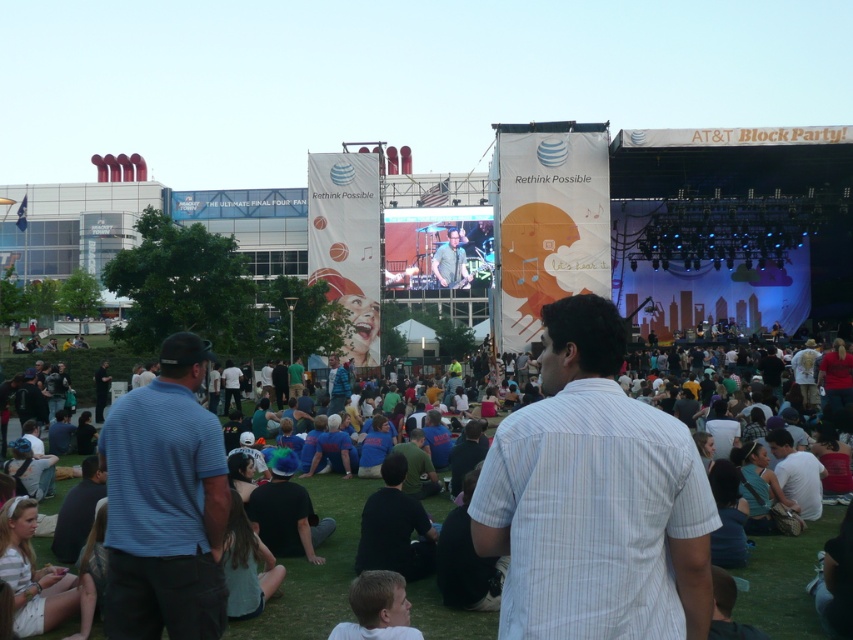
You are standing at the back of the crowd and want to see the stage better. There are two people in front of you, one wearing a dark gray shirt at center and the other wearing blue denim jeans at center. Which person should you ask to move so you can see better?

The dark gray shirt at center is much taller than the blue denim jeans at center, so you should ask the dark gray shirt at center to move to get a better view.

You are standing at the back of the crowd and want to see the stage. There are two people blocking your view in the center. The dark gray shirt at center and the blue denim jeans at center. Which one should you move around to the right to get a better view?

You should move around the blue denim jeans at center to the right since the dark gray shirt at center is already to the right of the blue denim jeans at center, so moving around the left side of the dark gray shirt at center or the right side of the blue denim jeans at center would allow you to see past them.

You are a photographer at the event and want to capture both the white striped shirt at center and the blue denim jeans at center in a single photo. Which object should you focus on first to ensure both are in frame?

The white striped shirt at center is much taller as blue denim jeans at center, so you should focus on the white striped shirt at center first to ensure both are in frame.